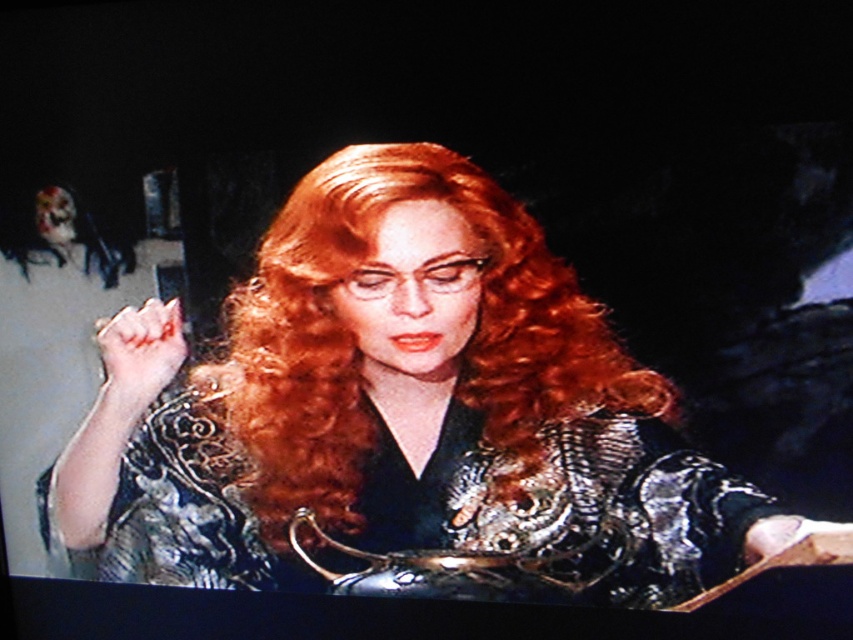
You are looking at the TV screen and see two points marked on it. The first point is at coordinates point (410, 304) and the second is at point (595, 540). Which point is nearer to you?

Point (410, 304) is closer to the viewer than point (595, 540).

You are a costume designer working on a historical drama. You need to determine if the shiny silver armor at center and the metallic silver dress at center can be worn together in a scene without overlapping. The minimum required distance between the two items to avoid overlapping is 3 inches. Based on the image, can they be worn together?

The shiny silver armor at center is 2.71 inches away from the metallic silver dress at center. Since the required distance to avoid overlapping is 3 inches, the 2.71 inches is less than the required distance. Therefore, they cannot be worn together without overlapping.

Based on the scene description, which object at center is taller between the shiny silver armor at center and the metallic silver dress at center?

The shiny silver armor at center is taller than the metallic silver dress at center.